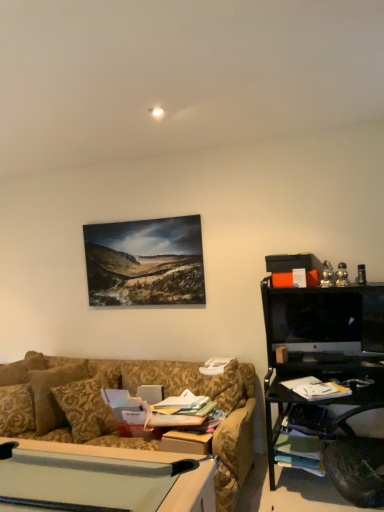
Question: Is black glossy monitor at right in contact with gold damask pillow at center?

Choices:
 (A) no
 (B) yes

Answer: (A)

Question: From a real-world perspective, is black glossy monitor at right on gold damask pillow at center?

Choices:
 (A) yes
 (B) no

Answer: (A)

Question: Does black glossy monitor at right have a smaller size compared to gold damask pillow at center?

Choices:
 (A) yes
 (B) no

Answer: (A)

Question: Is gold damask pillow at center inside black glossy monitor at right?

Choices:
 (A) no
 (B) yes

Answer: (A)

Question: Can you confirm if black glossy monitor at right is wider than gold damask pillow at center?

Choices:
 (A) yes
 (B) no

Answer: (B)

Question: Considering the relative sizes of black glossy monitor at right and gold damask pillow at center in the image provided, is black glossy monitor at right taller than gold damask pillow at center?

Choices:
 (A) yes
 (B) no

Answer: (B)

Question: Is gold damask pillow at center at the right side of black glossy monitor at right?

Choices:
 (A) no
 (B) yes

Answer: (A)

Question: Are gold damask pillow at center and black glossy monitor at right located far from each other?

Choices:
 (A) no
 (B) yes

Answer: (B)

Question: Is gold damask pillow at center turned away from black glossy monitor at right?

Choices:
 (A) no
 (B) yes

Answer: (A)

Question: From the image's perspective, does gold damask pillow at center appear higher than black glossy monitor at right?

Choices:
 (A) no
 (B) yes

Answer: (A)

Question: Considering the relative sizes of gold damask pillow at center and black glossy monitor at right in the image provided, is gold damask pillow at center taller than black glossy monitor at right?

Choices:
 (A) no
 (B) yes

Answer: (B)

Question: Is gold damask pillow at center located outside black glossy monitor at right?

Choices:
 (A) no
 (B) yes

Answer: (B)

Question: From a real-world perspective, relative to gold damask pillow at center, is black glossy monitor at right vertically above or below?

Choices:
 (A) below
 (B) above

Answer: (B)